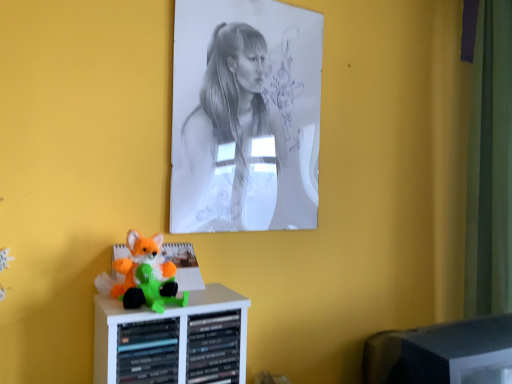
Question: Considering the relative positions of black plastic monitor at lower right and fluffy plush toy at lower left in the image provided, is black plastic monitor at lower right to the left of fluffy plush toy at lower left from the viewer's perspective?

Choices:
 (A) yes
 (B) no

Answer: (B)

Question: Are black plastic monitor at lower right and fluffy plush toy at lower left far apart?

Choices:
 (A) no
 (B) yes

Answer: (A)

Question: From a real-world perspective, is black plastic monitor at lower right over fluffy plush toy at lower left?

Choices:
 (A) no
 (B) yes

Answer: (A)

Question: Could you tell me if black plastic monitor at lower right is facing fluffy plush toy at lower left?

Choices:
 (A) yes
 (B) no

Answer: (B)

Question: Is the depth of black plastic monitor at lower right greater than that of fluffy plush toy at lower left?

Choices:
 (A) yes
 (B) no

Answer: (A)

Question: From the image's perspective, is black plastic monitor at lower right located above fluffy plush toy at lower left?

Choices:
 (A) yes
 (B) no

Answer: (B)

Question: Is graphite paper portrait at upper center positioned with its back to fluffy plush toy at lower left?

Choices:
 (A) no
 (B) yes

Answer: (A)

Question: Can you confirm if graphite paper portrait at upper center is thinner than fluffy plush toy at lower left?

Choices:
 (A) no
 (B) yes

Answer: (B)

Question: Is fluffy plush toy at lower left completely or partially inside graphite paper portrait at upper center?

Choices:
 (A) yes
 (B) no

Answer: (B)

Question: Considering the relative positions of graphite paper portrait at upper center and fluffy plush toy at lower left in the image provided, is graphite paper portrait at upper center to the right of fluffy plush toy at lower left from the viewer's perspective?

Choices:
 (A) yes
 (B) no

Answer: (A)

Question: Can we say graphite paper portrait at upper center lies outside fluffy plush toy at lower left?

Choices:
 (A) yes
 (B) no

Answer: (A)

Question: From a real-world perspective, does graphite paper portrait at upper center sit lower than fluffy plush toy at lower left?

Choices:
 (A) yes
 (B) no

Answer: (B)

Question: Can you confirm if fluffy plush toy at lower left is shorter than black plastic monitor at lower right?

Choices:
 (A) no
 (B) yes

Answer: (B)